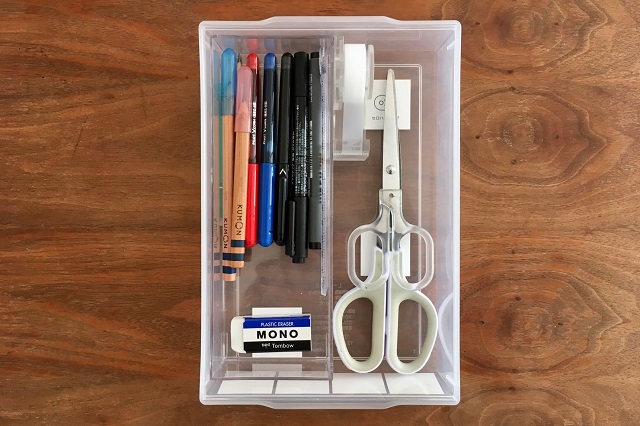
The image size is (640, 426). What are the coordinates of `writing implements` in the screenshot? It's located at (224, 110), (242, 122), (253, 62), (271, 60), (283, 81), (301, 82), (316, 88).